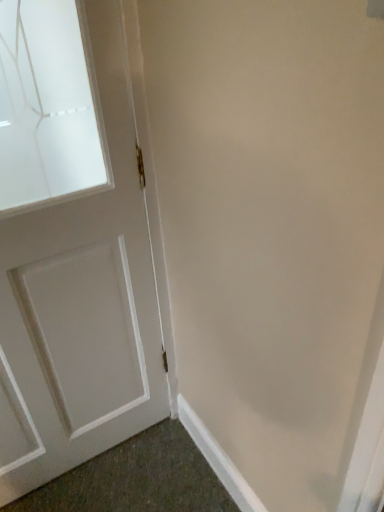
Question: Should I look upward or downward to see white painted wood door at left?

Choices:
 (A) down
 (B) up

Answer: (A)